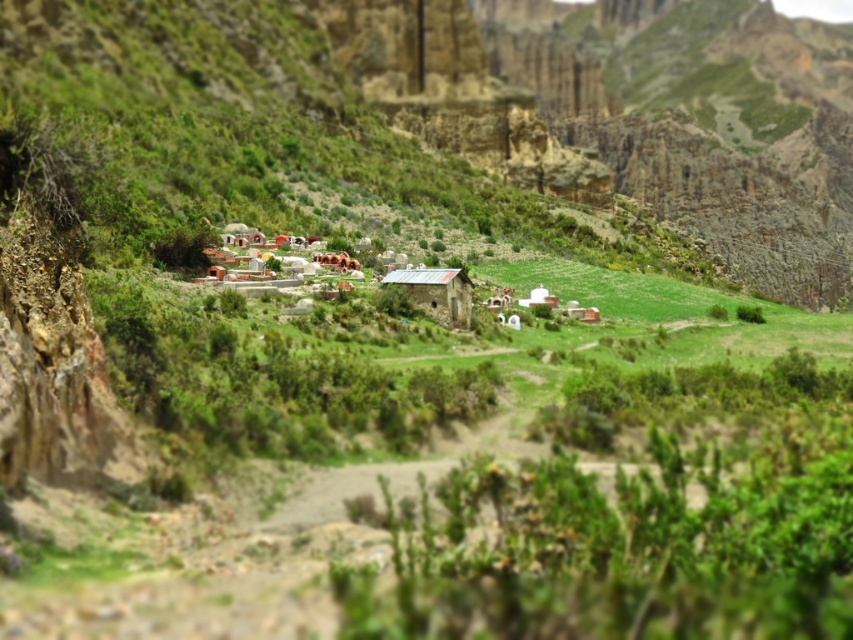
Question: Does white stone village at center appear on the left side of white clay hut at center?

Choices:
 (A) no
 (B) yes

Answer: (B)

Question: Which point appears closest to the camera in this image?

Choices:
 (A) (451, 292)
 (B) (457, 308)
 (C) (756, 125)

Answer: (A)

Question: Which object is the closest to the green grassy hill at center?

Choices:
 (A) rustic stone hut at center
 (B) white clay hut at center
 (C) white matte hut at center
 (D) white stone village at center

Answer: (A)

Question: Can you confirm if white stone village at center is positioned to the left of white matte hut at center?

Choices:
 (A) no
 (B) yes

Answer: (B)

Question: Can you confirm if green grassy hill at center is positioned to the left of white matte hut at center?

Choices:
 (A) yes
 (B) no

Answer: (B)

Question: Among these points, which one is farthest from the camera?

Choices:
 (A) (531, 298)
 (B) (434, 296)

Answer: (A)